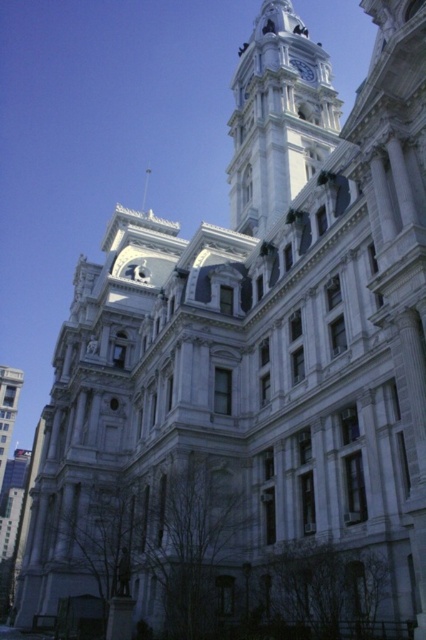
You are an architect examining the building from the front. You need to determine the vertical arrangement of the white stone clock tower at upper center and the blue glossy clock at upper center. Which one is positioned higher?

The blue glossy clock at upper center is positioned higher since the white stone clock tower at upper center is below it.

Based on the photo, you are an architect planning to install a new decorative element between the white stone clock tower at upper center and the blue glossy clock at upper center. Given their sizes, which object should the decorative element be placed closer to in order to maintain visual balance?

The decorative element should be placed closer to the blue glossy clock at upper center because the white stone clock tower at upper center is wider, and placing the element closer to the smaller blue glossy clock at upper center would help balance the composition.